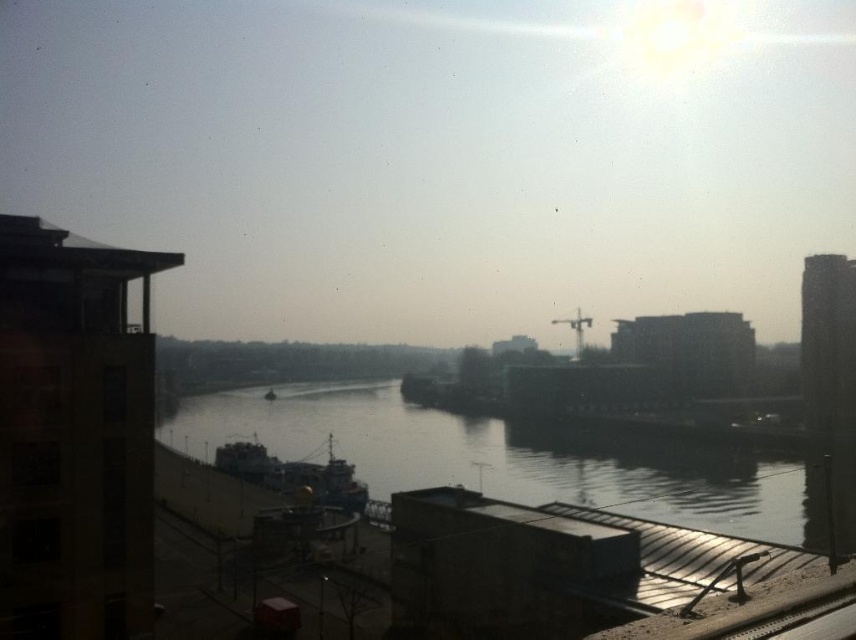
Question: Does smooth concrete river at center come in front of dark blue metallic ship at center?

Choices:
 (A) yes
 (B) no

Answer: (A)

Question: Can you confirm if smooth concrete river at center is wider than dark blue metallic ship at center?

Choices:
 (A) no
 (B) yes

Answer: (B)

Question: Which of the following is the closest to the observer?

Choices:
 (A) (355, 484)
 (B) (687, 472)

Answer: (A)

Question: Is smooth concrete river at center to the right of dark blue metallic ship at center from the viewer's perspective?

Choices:
 (A) no
 (B) yes

Answer: (B)

Question: Which of the following is the farthest from the observer?

Choices:
 (A) dark blue metallic ship at center
 (B) smooth concrete river at center

Answer: (A)